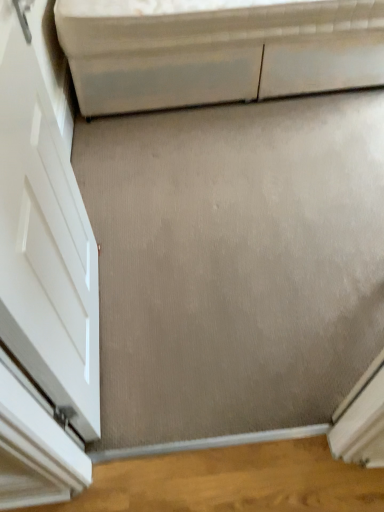
Where is `vacant space to the right of white glossy door at left`? The image size is (384, 512). vacant space to the right of white glossy door at left is located at coordinates (203, 317).